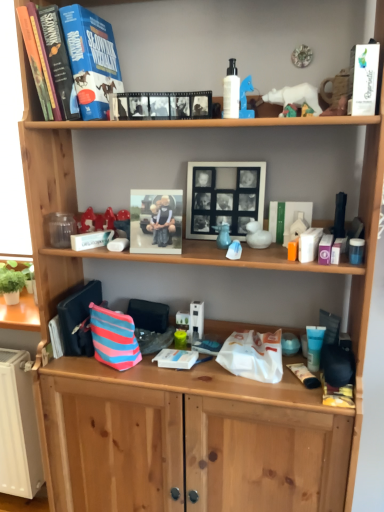
Question: Is striped fabric pouch at lower center taller than hardcover book at upper left, positioned as the second paperback book in front-to-back order?

Choices:
 (A) no
 (B) yes

Answer: (A)

Question: From a real-world perspective, is striped fabric pouch at lower center located higher than hardcover book at upper left, positioned as the second paperback book in front-to-back order?

Choices:
 (A) yes
 (B) no

Answer: (B)

Question: Could you tell me if striped fabric pouch at lower center is facing hardcover book at upper left, positioned as the second paperback book in front-to-back order?

Choices:
 (A) yes
 (B) no

Answer: (B)

Question: Considering the relative positions of striped fabric pouch at lower center and hardcover book at upper left, positioned as the 1th paperback book in left-to-right order, in the image provided, is striped fabric pouch at lower center in front of hardcover book at upper left, positioned as the 1th paperback book in left-to-right order,?

Choices:
 (A) yes
 (B) no

Answer: (B)

Question: From the image's perspective, does striped fabric pouch at lower center appear lower than hardcover book at upper left, positioned as the second paperback book in front-to-back order?

Choices:
 (A) yes
 (B) no

Answer: (A)

Question: From a real-world perspective, is striped fabric pouch at lower center located beneath hardcover book at upper left, the second paperback book positioned from the right?

Choices:
 (A) no
 (B) yes

Answer: (B)

Question: Can you confirm if hardcover book at upper left, which is the first paperback book from back to front, is wider than striped fabric pouch at lower center?

Choices:
 (A) yes
 (B) no

Answer: (A)

Question: Does hardcover book at upper left, which is the first paperback book from back to front, come in front of striped fabric pouch at lower center?

Choices:
 (A) no
 (B) yes

Answer: (B)

Question: From the image's perspective, would you say hardcover book at upper left, which is the first paperback book from back to front, is shown under striped fabric pouch at lower center?

Choices:
 (A) no
 (B) yes

Answer: (A)

Question: Does hardcover book at upper left, the second paperback book positioned from the right, lie behind striped fabric pouch at lower center?

Choices:
 (A) yes
 (B) no

Answer: (B)

Question: Does hardcover book at upper left, positioned as the second paperback book in front-to-back order, turn towards striped fabric pouch at lower center?

Choices:
 (A) no
 (B) yes

Answer: (A)

Question: Does hardcover book at upper left, positioned as the 1th paperback book in left-to-right order, have a lesser width compared to striped fabric pouch at lower center?

Choices:
 (A) yes
 (B) no

Answer: (B)

Question: Is hardcover book at upper left, positioned as the second paperback book in front-to-back order, outside of matte plastic photo frame at center, arranged as the second picture frame when viewed from the right?

Choices:
 (A) yes
 (B) no

Answer: (A)